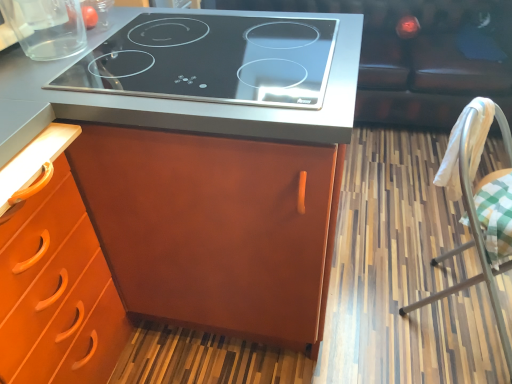
This screenshot has width=512, height=384. I want to click on free region under white fabric-covered chair at right (from a real-world perspective), so click(466, 317).